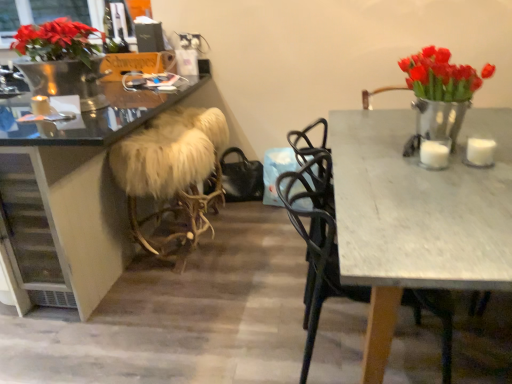
Question: From a real-world perspective, is white fur-covered stool at center physically located above or below white matte candle at right, the third candle in the left-to-right sequence?

Choices:
 (A) above
 (B) below

Answer: (B)

Question: Considering their positions, is white fur-covered stool at center located in front of or behind white matte candle at right, the 2th candle positioned from the back?

Choices:
 (A) behind
 (B) front

Answer: (A)

Question: Based on their relative distances, which object is nearer to the white matte candle at left, acting as the 1th candle starting from the back?

Choices:
 (A) white matte candle at right, placed as the 2th candle when sorted from front to back
 (B) shiny metallic vase with red tulips at right
 (C) white fur-covered stool at center
 (D) matte black desk at left
 (E) white marble table at right

Answer: (D)

Question: Based on their relative distances, which object is farther from the matte black desk at left?

Choices:
 (A) black metal chair at upper right
 (B) white fur-covered stool at center
 (C) white matte candle at right, marked as the first candle in a front-to-back arrangement
 (D) shiny metallic vase with red tulips at right
 (E) white marble table at right

Answer: (C)